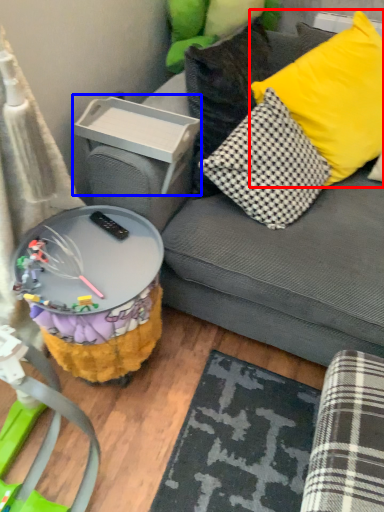
Question: Among these objects, which one is nearest to the camera, pillow (highlighted by a red box) or storage box (highlighted by a blue box)?

Choices:
 (A) pillow
 (B) storage box

Answer: (A)